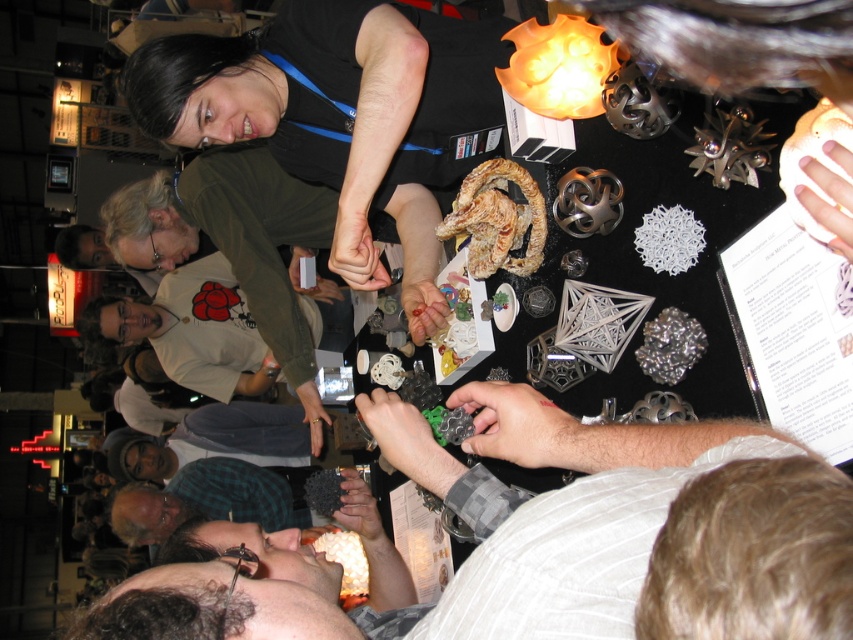
Can you confirm if gray fabric shirt at center is taller than green plaid shirt at lower center?

Yes, gray fabric shirt at center is taller than green plaid shirt at lower center.

How far apart are gray fabric shirt at center and green plaid shirt at lower center?

gray fabric shirt at center and green plaid shirt at lower center are 6.72 feet apart from each other.

Which is in front, point (827, 566) or point (160, 541)?

Positioned in front is point (827, 566).

Find the location of `gray fabric shirt at center`. gray fabric shirt at center is located at coordinates (566, 540).